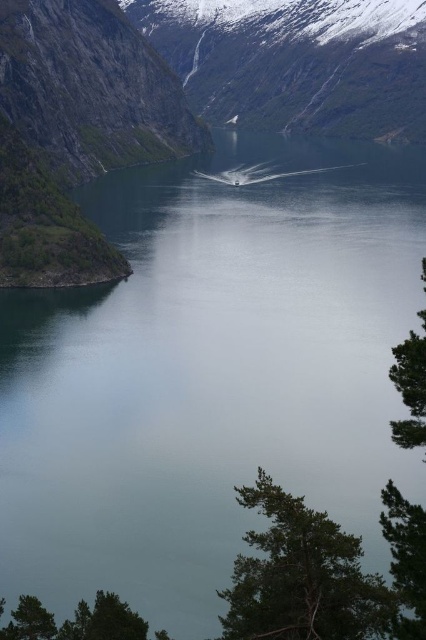
Does green textured tree at lower right appear on the left side of green textured tree at right?

Yes, green textured tree at lower right is to the left of green textured tree at right.

Who is positioned more to the left, green textured tree at lower right or green textured tree at right?

green textured tree at lower right

Which is behind, point (348, 634) or point (394, 362)?

Point (394, 362)

Locate an element on the screen. The width and height of the screenshot is (426, 640). green textured tree at lower right is located at coordinates (302, 577).